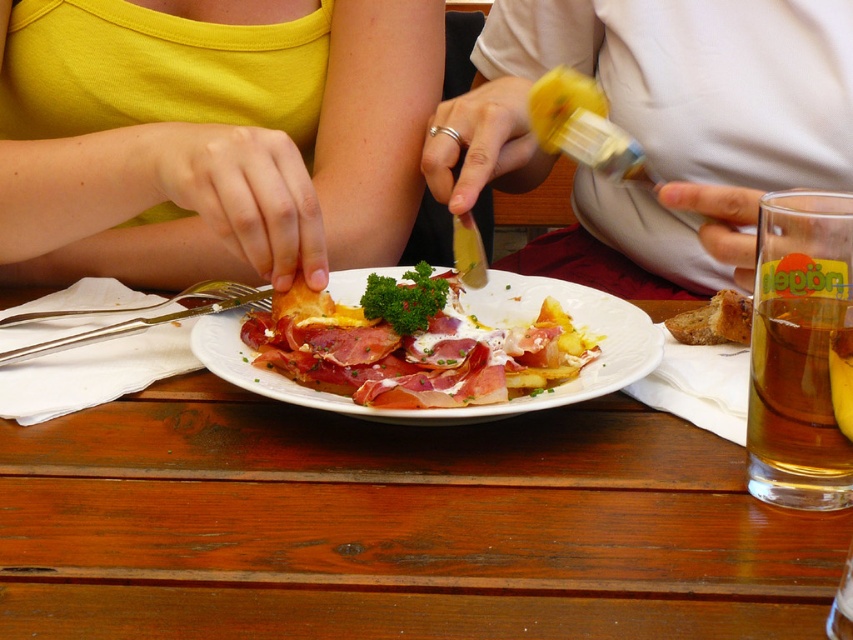
Question: Which point appears closest to the camera in this image?

Choices:
 (A) (13, 115)
 (B) (257, 436)

Answer: (B)

Question: Can you confirm if yellow matte tank top at upper left is wider than sliced cured meat at center?

Choices:
 (A) no
 (B) yes

Answer: (B)

Question: From the image, what is the correct spatial relationship of white matte shirt at center in relation to golden amber liquid at right?

Choices:
 (A) left
 (B) right

Answer: (B)

Question: Which object is farther from the camera taking this photo?

Choices:
 (A) yellow matte tank top at upper left
 (B) golden amber liquid at right
 (C) brown crumbly bread at center

Answer: (C)

Question: Considering the relative positions of white matte shirt at center and golden amber liquid at right in the image provided, where is white matte shirt at center located with respect to golden amber liquid at right?

Choices:
 (A) above
 (B) below

Answer: (A)

Question: Based on their relative distances, which object is nearer to the silver metallic fork at plate left?

Choices:
 (A) brown crumbly bread at center
 (B) wooden table at center
 (C) yellow matte tank top at upper left

Answer: (C)